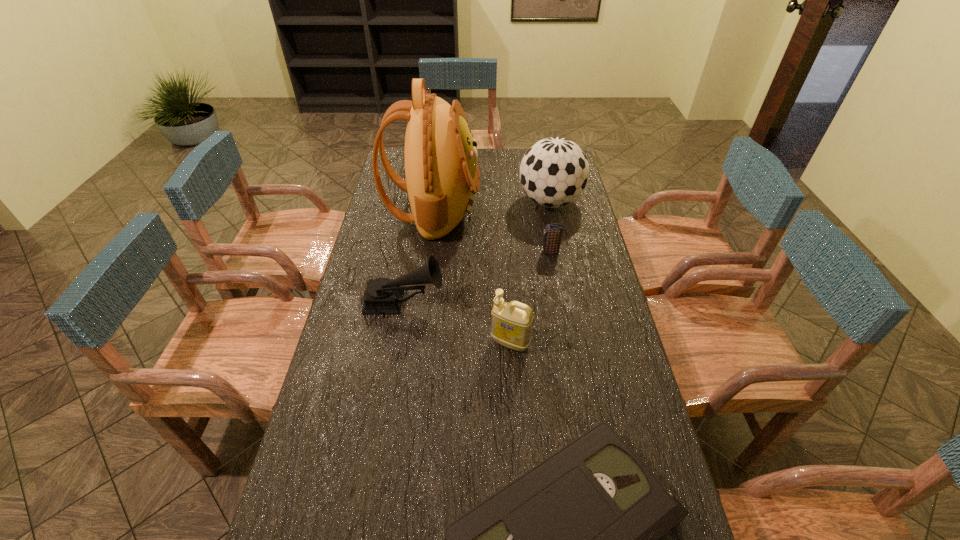
Where is `the tallest object`? The image size is (960, 540). the tallest object is located at coordinates (442, 176).

The image size is (960, 540). What are the coordinates of `soccer ball` in the screenshot? It's located at (x=554, y=172).

You are a GUI agent. You are given a task and a screenshot of the screen. Output one action in this format:
    pyautogui.click(x=<x>, y=<y>)
    Task: Click on the detergent
    The height and width of the screenshot is (540, 960).
    Given the screenshot: What is the action you would take?
    pyautogui.click(x=512, y=321)

Locate an element on the screen. Image resolution: width=960 pixels, height=540 pixels. phonograph_record is located at coordinates (383, 296).

Find the location of a particular element. This screenshot has height=540, width=960. the fifth tallest object is located at coordinates click(553, 232).

Locate an element on the screen. The width and height of the screenshot is (960, 540). clutch bag is located at coordinates (553, 232).

I want to click on blank space located 0.180m on the front-facing side of the tallest object, so click(523, 210).

I want to click on vacant space situated on the left of the soccer ball, so click(x=477, y=202).

The height and width of the screenshot is (540, 960). What are the coordinates of `free spot located on the right of the detergent` in the screenshot? It's located at (566, 343).

Find the location of a particular element. Image resolution: width=960 pixels, height=540 pixels. vacant point located 0.120m from the horn of the phonograph_record is located at coordinates (480, 303).